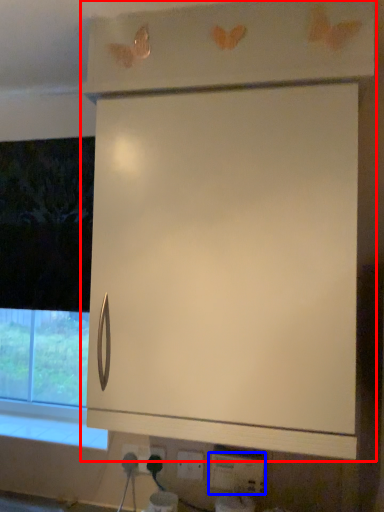
Question: Which point is closer to the camera, cabinetry (highlighted by a red box) or electric outlet (highlighted by a blue box)?

Choices:
 (A) cabinetry
 (B) electric outlet

Answer: (A)